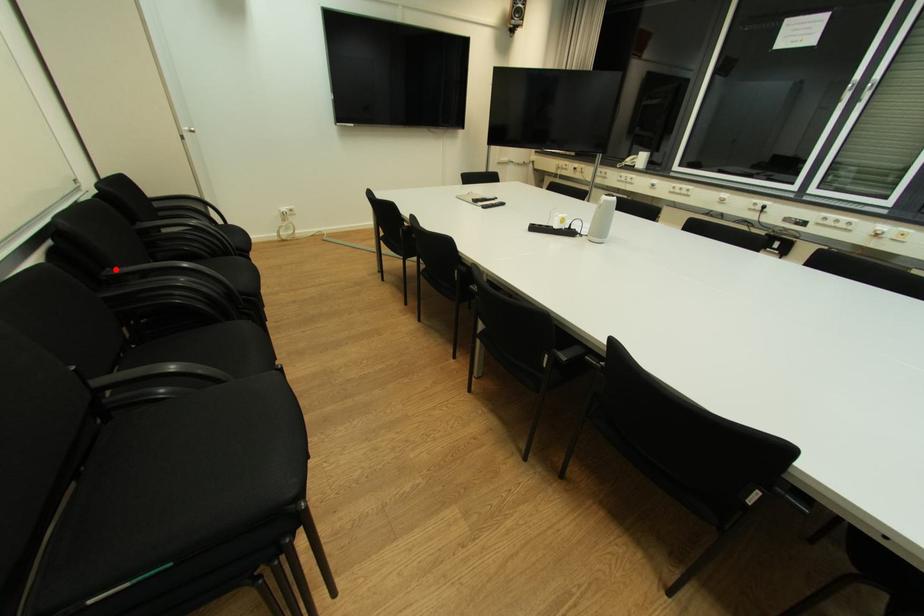
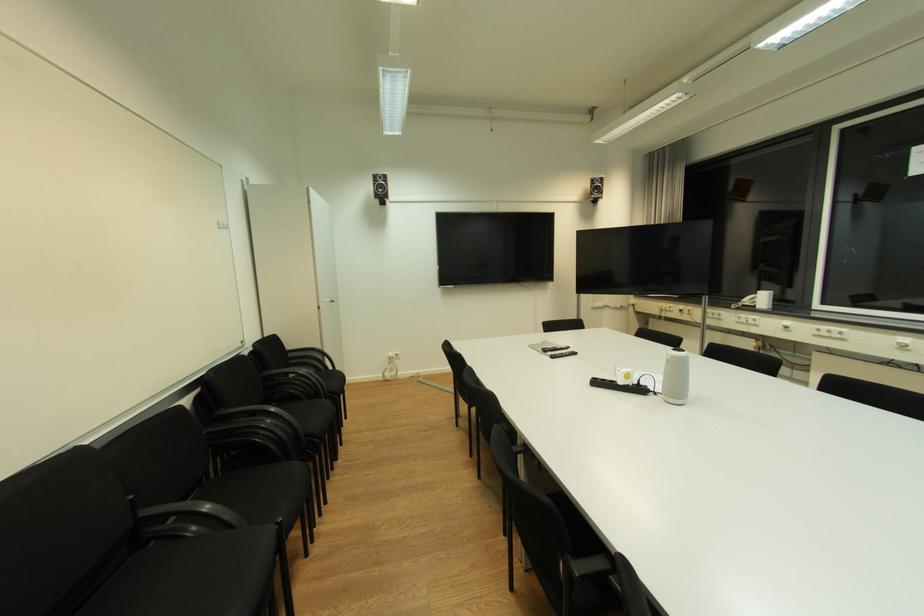
Question: I am providing you with two images of the same scene from different viewpoints. A red point is shown in image1. For the corresponding object point in image2, is it positioned nearer or farther from the camera?

Choices:
 (A) Nearer
 (B) Farther

Answer: (A)